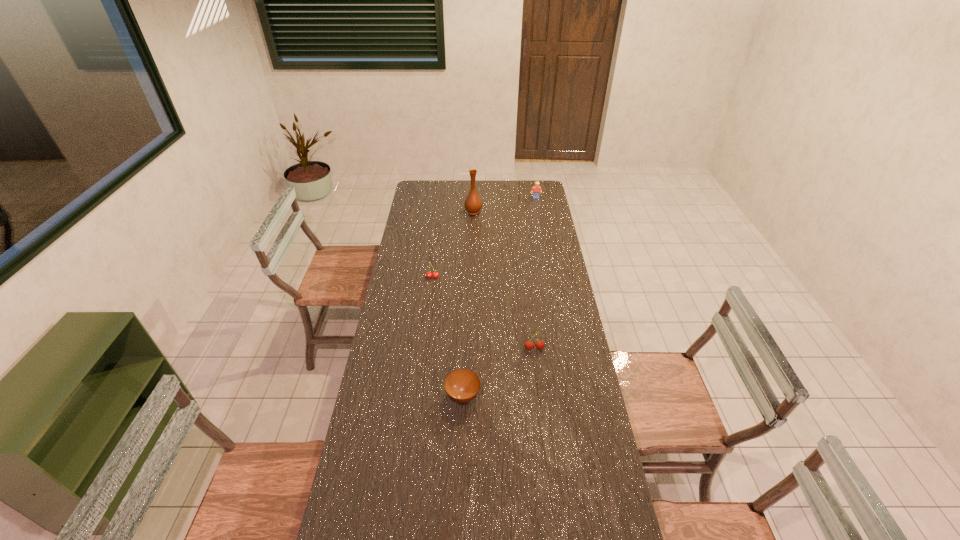
Locate an element on the screen. Image resolution: width=960 pixels, height=540 pixels. blank space at the left edge is located at coordinates (389, 326).

The width and height of the screenshot is (960, 540). In order to click on vacant space at the right edge of the desktop in this screenshot , I will do `click(562, 262)`.

In the image, there is a desktop. In order to click on vacant space at the far right corner in this screenshot , I will do `click(526, 194)`.

The width and height of the screenshot is (960, 540). Identify the location of vacant point located between the nearest object and the left cherry. (447, 336).

The height and width of the screenshot is (540, 960). In order to click on vacant point located between the nearer cherry and the shortest object in this screenshot , I will do `click(498, 372)`.

Locate an element on the screen. empty location between the nearer cherry and the shortest object is located at coordinates (498, 372).

The image size is (960, 540). I want to click on vacant space in between the shortest object and the right cherry, so click(498, 372).

Locate an element on the screen. The image size is (960, 540). free space between the shorter cherry and the shortest object is located at coordinates (447, 336).

At what (x,y) coordinates should I click in order to perform the action: click on free area in between the left cherry and the second object from right to left. Please return your answer as a coordinate pair (x, y). Image resolution: width=960 pixels, height=540 pixels. Looking at the image, I should click on (483, 313).

In order to click on free space between the Lego and the right cherry in this screenshot , I will do `click(535, 273)`.